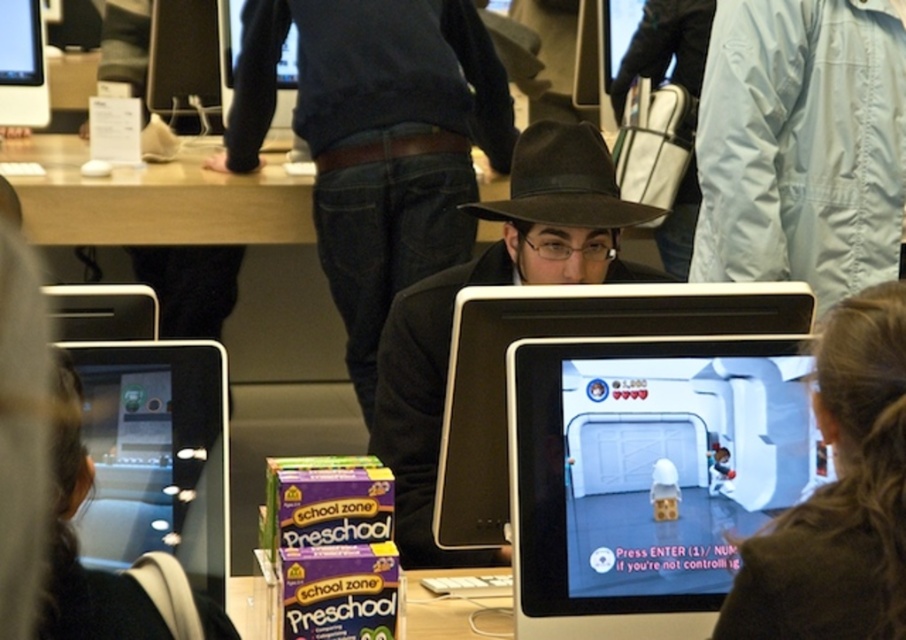
Question: Estimate the real-world distances between objects in this image. Which object is closer to the purple cardboard box at center?

Choices:
 (A) black glossy tablet at left
 (B) light brown wood table at upper center

Answer: (A)

Question: Does matte black tablet at center come behind matte black monitor at upper left?

Choices:
 (A) no
 (B) yes

Answer: (A)

Question: Can you confirm if light blue fabric jacket at center is positioned above light brown wood table at upper center?

Choices:
 (A) yes
 (B) no

Answer: (B)

Question: Observing the image, what is the correct spatial positioning of light brown wood table at upper center in reference to purple cardboard box at center?

Choices:
 (A) below
 (B) above

Answer: (B)

Question: Estimate the real-world distances between objects in this image. Which object is closer to the dark blue sweater at center?

Choices:
 (A) matte black hat at center
 (B) light blue fabric jacket at center
 (C) brown leather jacket at center
 (D) matte black tablet at center

Answer: (A)

Question: Estimate the real-world distances between objects in this image. Which object is farther from the light brown wood table at upper center?

Choices:
 (A) black glossy tablet at left
 (B) matte black monitor at upper left
 (C) brown felt cowboy hat at center
 (D) matte black hat at center

Answer: (A)